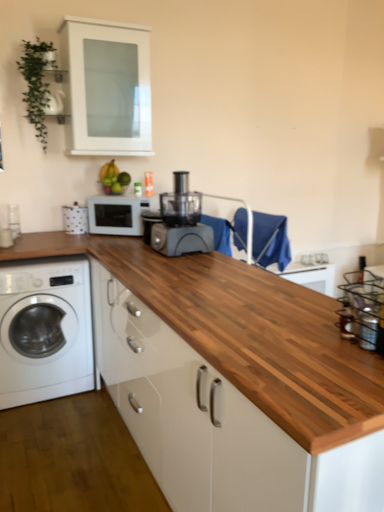
The image size is (384, 512). Find the location of `vacant space situated on the left part of clear glass bottle at right`. vacant space situated on the left part of clear glass bottle at right is located at coordinates (294, 339).